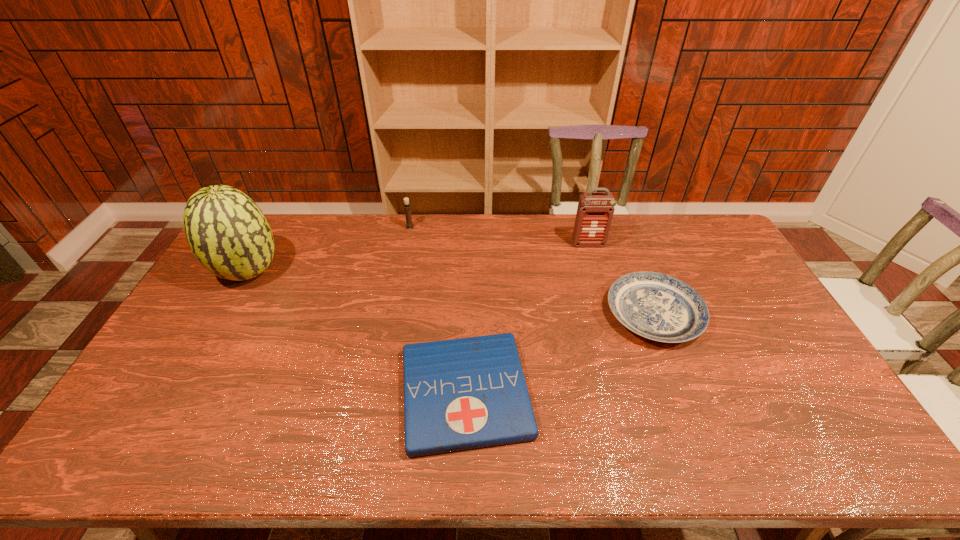
Locate an element on the screen. The width and height of the screenshot is (960, 540). vacant space at the far edge is located at coordinates (529, 238).

I want to click on blank area at the near edge, so click(x=542, y=443).

Find the location of a particular element. This screenshot has height=540, width=960. vacant region at the left edge is located at coordinates (239, 302).

Image resolution: width=960 pixels, height=540 pixels. Find the location of `free space at the right edge of the desktop`. free space at the right edge of the desktop is located at coordinates (787, 357).

The image size is (960, 540). I want to click on free space at the near left corner of the desktop, so click(162, 431).

Find the location of a particular element. The image size is (960, 540). vacant space at the far right corner is located at coordinates (703, 249).

Where is `vacant area that lies between the fourth nearest object and the second object from left to right`? This screenshot has width=960, height=540. vacant area that lies between the fourth nearest object and the second object from left to right is located at coordinates (499, 235).

The width and height of the screenshot is (960, 540). Identify the location of free space between the shortest object and the second object from left to right. (438, 310).

At what (x,y) coordinates should I click in order to perform the action: click on free spot between the shorter first-aid kit and the fourth object from right to left. Please return your answer as a coordinate pair (x, y). The image size is (960, 540). Looking at the image, I should click on (438, 310).

Locate an element on the screen. vacant area that lies between the candle holder and the tallest object is located at coordinates (329, 249).